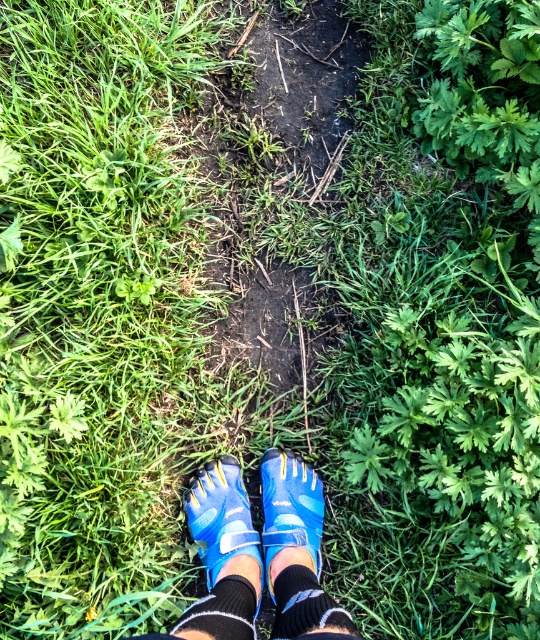
Question: Among these objects, which one is nearest to the camera?

Choices:
 (A) blue mesh shoes at center
 (B) blue synthetic shoe at lower center
 (C) blue synthetic shoe at center

Answer: (A)

Question: Is blue synthetic shoe at lower center positioned at the back of black knitted sock at lower center?

Choices:
 (A) yes
 (B) no

Answer: (A)

Question: Does blue synthetic shoe at lower center appear under black knitted sock at lower center?

Choices:
 (A) yes
 (B) no

Answer: (B)

Question: Does black knitted sock at lower center have a larger size compared to black knit sock at lower center?

Choices:
 (A) no
 (B) yes

Answer: (A)

Question: Among these points, which one is nearest to the camera?

Choices:
 (A) 271,637
 (B) 208,612

Answer: (B)

Question: Which of the following is the closest to the observer?

Choices:
 (A) black knitted sock at lower center
 (B) blue mesh shoes at center
 (C) blue synthetic shoe at center

Answer: (A)